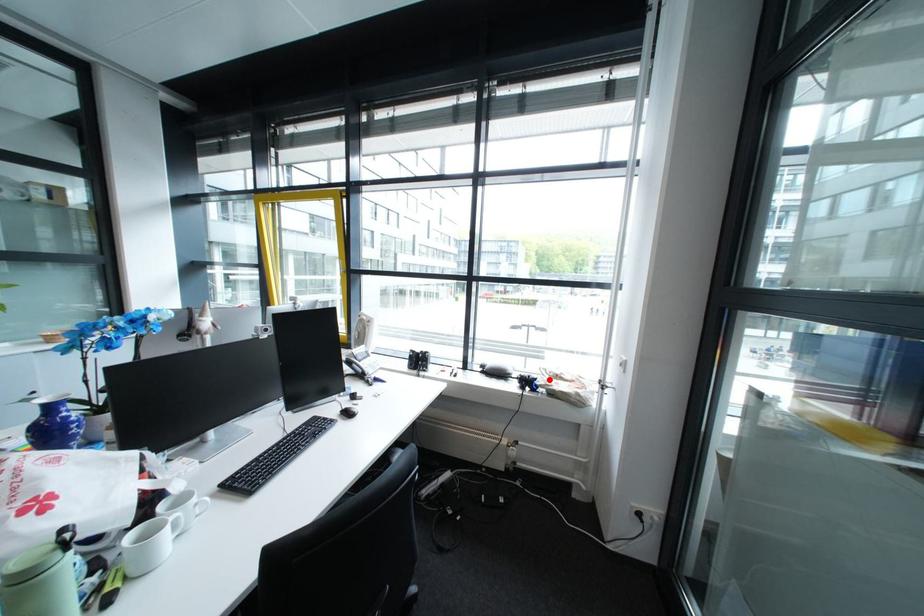
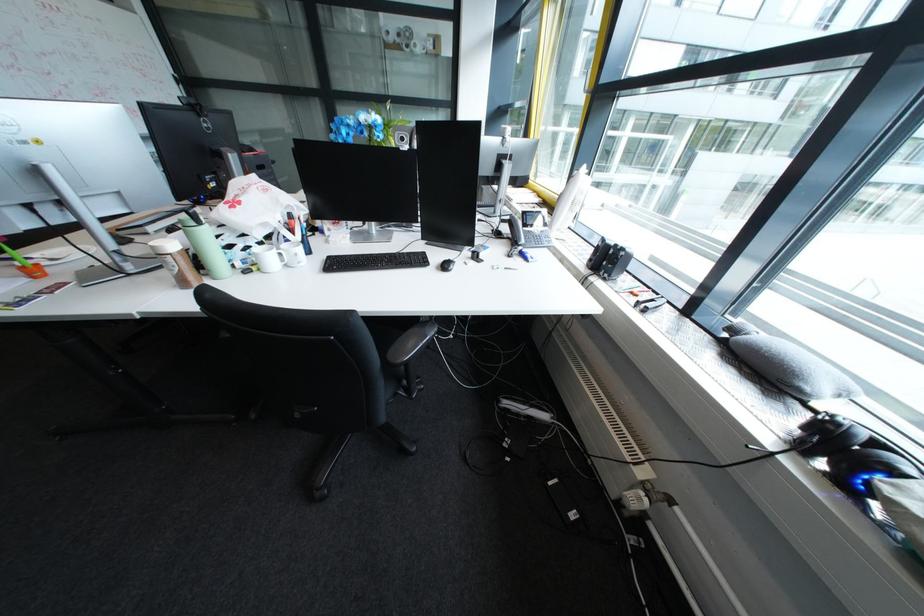
Question: I am providing you with two images of the same scene from different viewpoints. A red point is shown in image1. For the corresponding object point in image2, is it positioned nearer or farther from the camera?

Choices:
 (A) Nearer
 (B) Farther

Answer: (B)